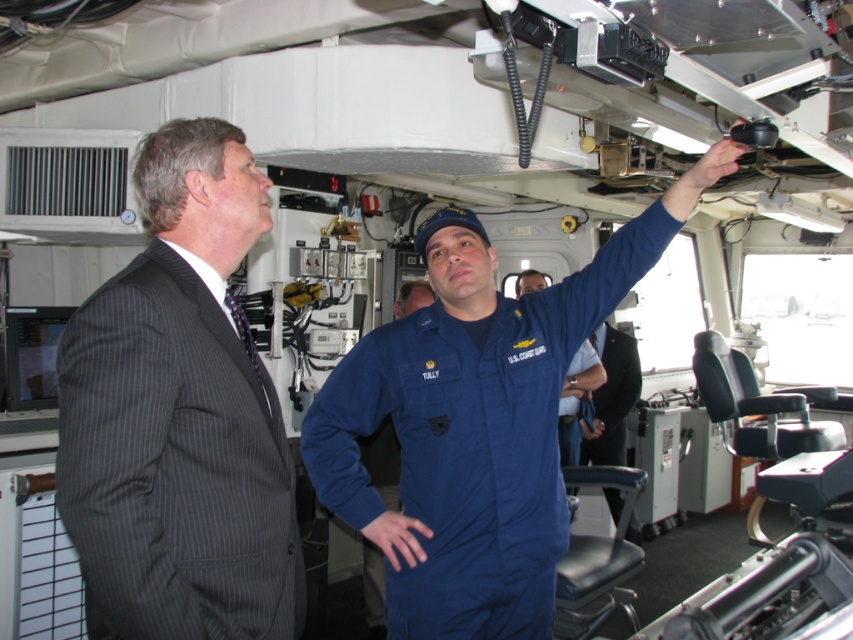
Question: Is dark gray pinstripe suit at left further to the viewer compared to blue uniform at center?

Choices:
 (A) yes
 (B) no

Answer: (B)

Question: Is dark gray pinstripe suit at left bigger than blue uniform at center?

Choices:
 (A) no
 (B) yes

Answer: (A)

Question: Which point is closer to the camera?

Choices:
 (A) (453, 506)
 (B) (117, 275)

Answer: (B)

Question: Which of the following is the closest to the observer?

Choices:
 (A) dark gray pinstripe suit at left
 (B) blue uniform at center

Answer: (A)

Question: Does dark gray pinstripe suit at left have a greater width compared to blue uniform at center?

Choices:
 (A) yes
 (B) no

Answer: (B)